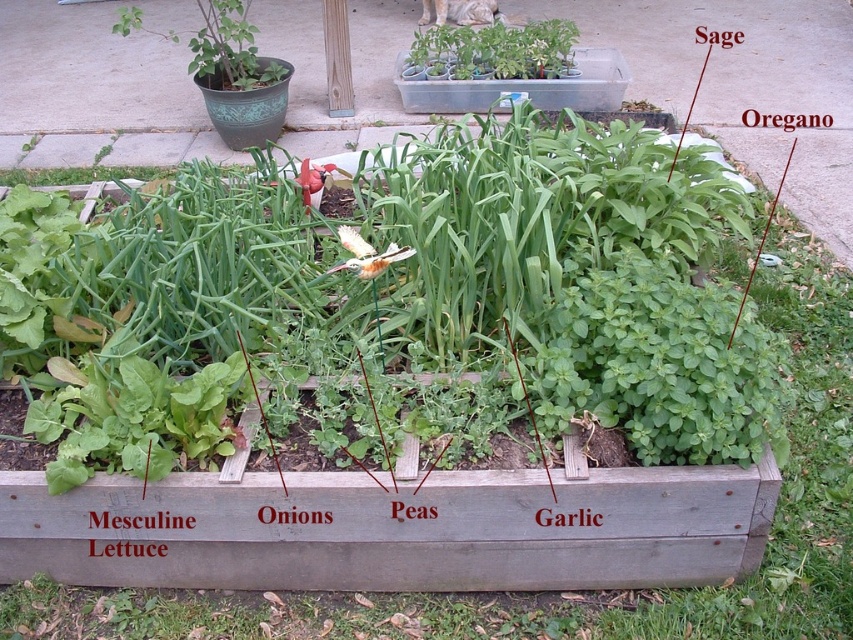
Can you confirm if clear plastic tray at upper center is positioned to the right of white matte flower at center?

In fact, clear plastic tray at upper center is to the left of white matte flower at center.

Does point (602, 49) lie behind point (537, 38)?

Yes, it is behind point (537, 38).

Find the location of a particular element. clear plastic tray at upper center is located at coordinates tap(523, 88).

Does point (369, 250) come closer to viewer compared to point (538, 44)?

Yes, it is.

Does translucent white butterfly at center appear on the right side of white matte flower at center?

In fact, translucent white butterfly at center is to the left of white matte flower at center.

Identify the location of translucent white butterfly at center. The height and width of the screenshot is (640, 853). (367, 253).

Who is higher up, clear plastic tray at upper center or translucent white butterfly at center?

clear plastic tray at upper center

Who is more distant from viewer, (410, 104) or (350, 262)?

Positioned behind is point (410, 104).

Which is in front, point (616, 106) or point (343, 268)?

Point (343, 268) is in front.

What are the coordinates of `clear plastic tray at upper center` in the screenshot? It's located at tap(523, 88).